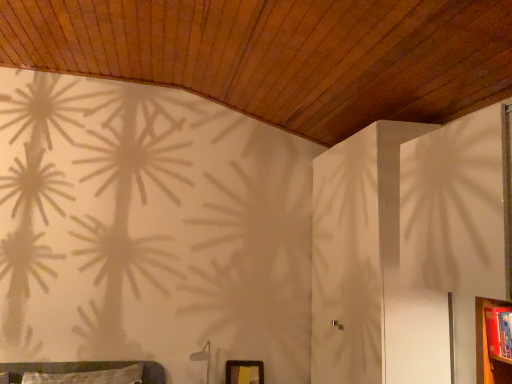
Question: In the image, is matte black picture frame at lower center on the left side or the right side of wooden dresser at lower right?

Choices:
 (A) left
 (B) right

Answer: (A)

Question: From the image's perspective, is matte black picture frame at lower center positioned above or below wooden dresser at lower right?

Choices:
 (A) below
 (B) above

Answer: (A)

Question: In the image, is matte black picture frame at lower center positioned in front of or behind wooden dresser at lower right?

Choices:
 (A) front
 (B) behind

Answer: (B)

Question: Considering their positions, is wooden dresser at lower right located in front of or behind matte black picture frame at lower center?

Choices:
 (A) front
 (B) behind

Answer: (A)

Question: Based on their sizes in the image, would you say wooden dresser at lower right is bigger or smaller than matte black picture frame at lower center?

Choices:
 (A) big
 (B) small

Answer: (A)

Question: Choose the correct answer: Is wooden dresser at lower right inside matte black picture frame at lower center or outside it?

Choices:
 (A) outside
 (B) inside

Answer: (A)

Question: Considering the positions of wooden dresser at lower right and matte black picture frame at lower center in the image, is wooden dresser at lower right taller or shorter than matte black picture frame at lower center?

Choices:
 (A) short
 (B) tall

Answer: (B)